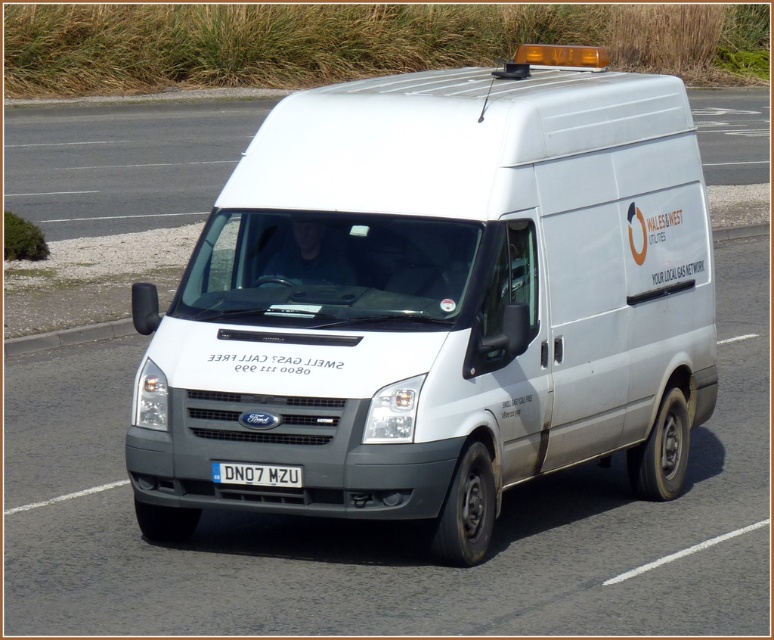
Question: Is white matte van at center bigger than white plastic license plate at center?

Choices:
 (A) yes
 (B) no

Answer: (A)

Question: Which object appears closest to the camera in this image?

Choices:
 (A) white plastic license plate at center
 (B) white matte van at center

Answer: (A)

Question: Where is white matte van at center located in relation to white plastic license plate at center in the image?

Choices:
 (A) above
 (B) below

Answer: (A)

Question: Does white matte van at center come behind white plastic license plate at center?

Choices:
 (A) no
 (B) yes

Answer: (B)